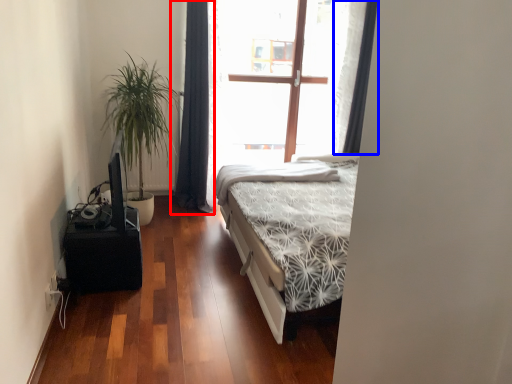
Question: Among these objects, which one is farthest to the camera, curtain (highlighted by a red box) or curtain (highlighted by a blue box)?

Choices:
 (A) curtain
 (B) curtain

Answer: (B)